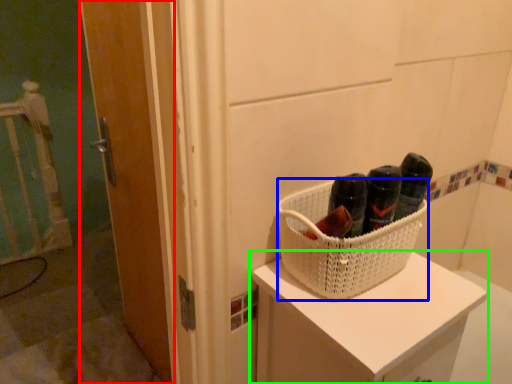
Question: Which object is positioned farthest from door (highlighted by a red box)? Select from basket (highlighted by a blue box) and furniture (highlighted by a green box).

Choices:
 (A) basket
 (B) furniture

Answer: (A)